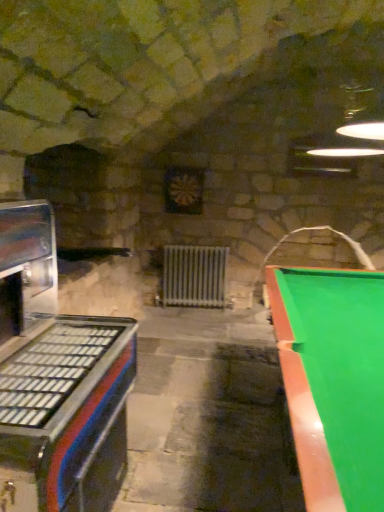
Question: Considering the positions of metallic blue and red arcade machine at left and green glossy pool table at right in the image, is metallic blue and red arcade machine at left taller or shorter than green glossy pool table at right?

Choices:
 (A) short
 (B) tall

Answer: (B)

Question: Is metallic blue and red arcade machine at left to the left or to the right of green glossy pool table at right in the image?

Choices:
 (A) left
 (B) right

Answer: (A)

Question: Which object is the closest to the white metallic radiator at center?

Choices:
 (A) green glossy pool table at right
 (B) metallic blue and red arcade machine at left

Answer: (A)

Question: Estimate the real-world distances between objects in this image. Which object is farther from the white metallic radiator at center?

Choices:
 (A) metallic blue and red arcade machine at left
 (B) green glossy pool table at right

Answer: (A)